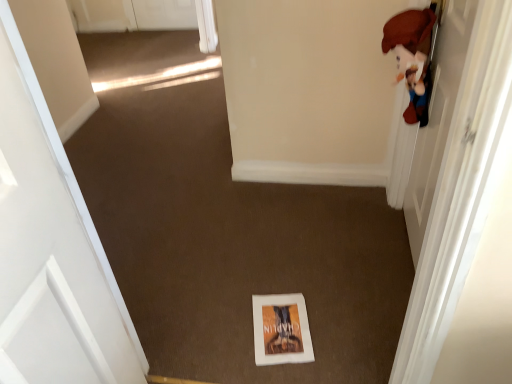
I want to click on blank space to the left of white paper book at center, so click(x=228, y=332).